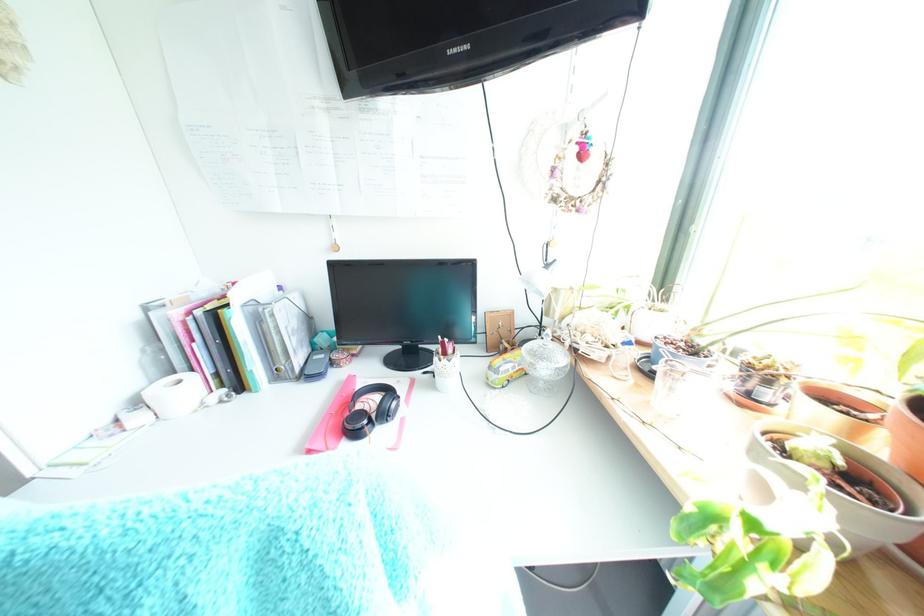
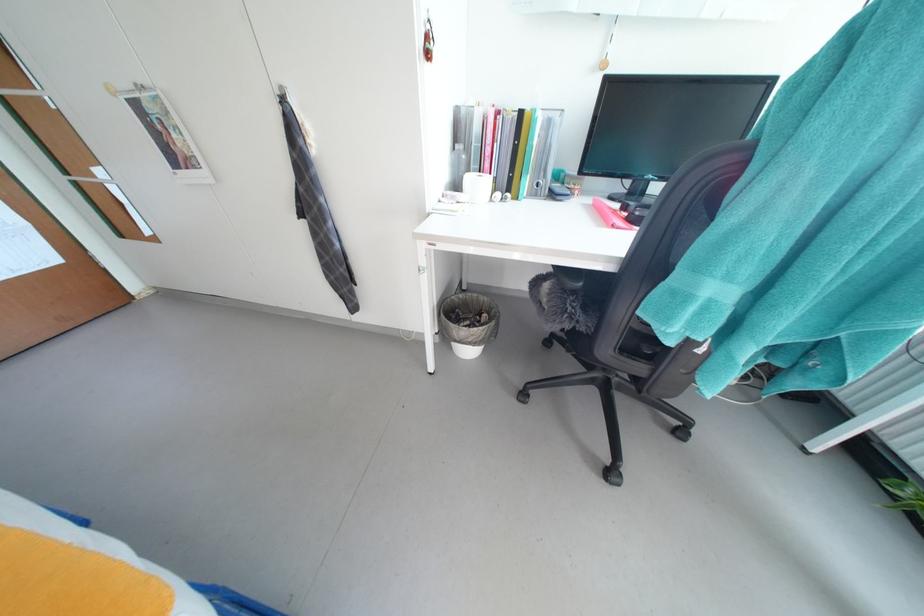
Find the pixel in the second image that matches point (225, 377) in the first image.

(503, 182)